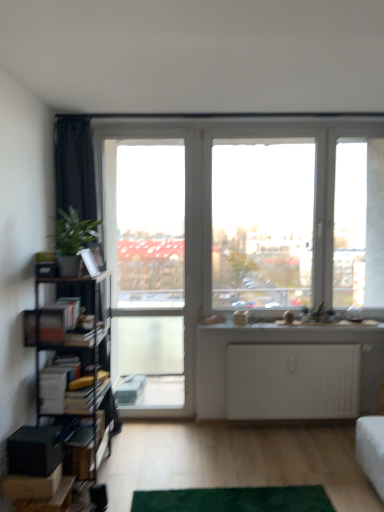
What is the approximate width of green carpet at lower center?

10.68 inches.

In order to face green carpet at lower center, should I rotate leftwards or rightwards?

Turn right by 5.164 degrees to look at green carpet at lower center.

I want to click on hardcover books at left, the second book positioned from the top, so click(x=65, y=390).

Where is `green leafy plant at left`? The height and width of the screenshot is (512, 384). green leafy plant at left is located at coordinates (74, 243).

Find the location of a particular element. The width and height of the screenshot is (384, 512). metallic black bookshelf at left is located at coordinates (90, 449).

Identify the location of hardcover books at left, the 1th book when ordered from top to bottom. The height and width of the screenshot is (512, 384). click(x=67, y=310).

You are a GUI agent. You are given a task and a screenshot of the screen. Output one action in this format:
    pyautogui.click(x=<x>, y=<y>)
    Task: Click on the green carpet at lower center
    
    Given the screenshot: What is the action you would take?
    pyautogui.click(x=234, y=499)

Is metallic black bookshelf at left in front of or behind transparent glass window at center in the image?

Visually, metallic black bookshelf at left is located in front of transparent glass window at center.

From their relative heights in the image, would you say metallic black bookshelf at left is taller or shorter than transparent glass window at center?

Clearly, metallic black bookshelf at left is shorter compared to transparent glass window at center.

Where is `shelf lying on the left of transparent glass window at center`? Image resolution: width=384 pixels, height=512 pixels. shelf lying on the left of transparent glass window at center is located at coordinates (90, 449).

In the scene shown: From a real-world perspective, is transparent glass window at center above or below metallic black bookshelf at left?

In terms of real-world spatial position, transparent glass window at center is above metallic black bookshelf at left.

How far apart are transparent glass window at center and metallic black bookshelf at left?

transparent glass window at center and metallic black bookshelf at left are 2.66 meters apart.

Between transparent glass window at center and metallic black bookshelf at left, which one has larger width?

Wider between the two is metallic black bookshelf at left.

Considering the sizes of transparent glass window at center and metallic black bookshelf at left in the image, is transparent glass window at center bigger or smaller than metallic black bookshelf at left?

In the image, transparent glass window at center appears to be smaller than metallic black bookshelf at left.

Considering the relative sizes of green carpet at lower center and transparent glass window at center in the image provided, is green carpet at lower center wider than transparent glass window at center?

Yes.

Does green carpet at lower center appear on the right side of transparent glass window at center?

Incorrect, green carpet at lower center is not on the right side of transparent glass window at center.

Looking at this image, between green carpet at lower center and transparent glass window at center, which one has smaller size?

With smaller size is green carpet at lower center.

Considering the positions of objects green carpet at lower center and transparent glass window at center in the image provided, who is behind, green carpet at lower center or transparent glass window at center?

transparent glass window at center is further from the camera.

How far apart are transparent glass window at center and clear glass screen door at center?

A distance of 1.48 meters exists between transparent glass window at center and clear glass screen door at center.

From a real-world perspective, is transparent glass window at center over clear glass screen door at center?

Yes, from a real-world perspective, transparent glass window at center is on top of clear glass screen door at center.

From the image's perspective, is transparent glass window at center positioned above or below clear glass screen door at center?

From the image's perspective, transparent glass window at center appears above clear glass screen door at center.

Is transparent glass window at center outside of clear glass screen door at center?

Yes, transparent glass window at center is outside of clear glass screen door at center.

Consider the image. Which object is more forward, green leafy plant at left or transparent glass window at center?

green leafy plant at left.

From the image's perspective, which is above, green leafy plant at left or transparent glass window at center?

transparent glass window at center appears higher in the image.

Is green leafy plant at left looking in the opposite direction of transparent glass window at center?

No, green leafy plant at left's orientation is not away from transparent glass window at center.

From the image's perspective, does clear glass screen door at center appear lower than metallic black bookshelf at left?

No, from the image's perspective, clear glass screen door at center is not below metallic black bookshelf at left.

From a real-world perspective, is clear glass screen door at center above or below metallic black bookshelf at left?

clear glass screen door at center is situated higher than metallic black bookshelf at left in the real world.

Is clear glass screen door at center behind metallic black bookshelf at left?

That is True.

From their relative heights in the image, would you say clear glass screen door at center is taller or shorter than green carpet at lower center?

Considering their sizes, clear glass screen door at center has more height than green carpet at lower center.

Between point (187, 339) and point (257, 494), which one is positioned behind?

The point (187, 339) is behind.

Is clear glass screen door at center facing towards green carpet at lower center?

No, clear glass screen door at center is not oriented towards green carpet at lower center.

Are clear glass screen door at center and green carpet at lower center far apart?

Absolutely, clear glass screen door at center is distant from green carpet at lower center.

At what (x,y) coordinates should I click in order to perform the action: click on window screen above the metallic black bookshelf at left (from the image's perspective). Please return your answer as a coordinate pair (x, y). The image size is (384, 512). Looking at the image, I should click on (262, 222).

This screenshot has height=512, width=384. In order to click on window screen lying behind the metallic black bookshelf at left in this screenshot , I will do `click(262, 222)`.

Which object lies further to the anchor point green carpet at lower center, green leafy plant at left or hardcover books at left, the second book positioned from the top?

The object further to green carpet at lower center is green leafy plant at left.

Looking at the image, which one is located further to hardcover books at left, the first book when ordered from bottom to top, transparent glass window at center or hardcover books at left, marked as the 2th book in a bottom-to-top arrangement?

transparent glass window at center lies further to hardcover books at left, the first book when ordered from bottom to top, than the other object.

When comparing their distances from green carpet at lower center, does hardcover books at left, the second book positioned from the top, or hardcover books at left, marked as the 2th book in a bottom-to-top arrangement, seem closer?

hardcover books at left, the second book positioned from the top, is positioned closer to the anchor green carpet at lower center.

When comparing their distances from hardcover books at left, the 1th book when ordered from top to bottom, does green carpet at lower center or clear glass screen door at center seem further?

Among the two, green carpet at lower center is located further to hardcover books at left, the 1th book when ordered from top to bottom.

Considering their positions, is transparent glass window at center positioned closer to hardcover books at left, marked as the 2th book in a bottom-to-top arrangement, than clear glass screen door at center?

clear glass screen door at center is closer to hardcover books at left, marked as the 2th book in a bottom-to-top arrangement.

Based on their spatial positions, is green carpet at lower center or clear glass screen door at center further from hardcover books at left, the second book positioned from the top?

clear glass screen door at center is positioned further to the anchor hardcover books at left, the second book positioned from the top.

Considering their positions, is hardcover books at left, the second book positioned from the top, positioned closer to transparent glass window at center than metallic black bookshelf at left?

metallic black bookshelf at left is closer to transparent glass window at center.

Estimate the real-world distances between objects in this image. Which object is closer to hardcover books at left, the second book positioned from the top, green leafy plant at left or clear glass screen door at center?

green leafy plant at left is closer to hardcover books at left, the second book positioned from the top.

Where is `shelf between transparent glass window at center and green carpet at lower center in the vertical direction`? The width and height of the screenshot is (384, 512). shelf between transparent glass window at center and green carpet at lower center in the vertical direction is located at coordinates (90, 449).

This screenshot has width=384, height=512. What are the coordinates of `book between hardcover books at left, marked as the 2th book in a bottom-to-top arrangement, and transparent glass window at center, in the horizontal direction` in the screenshot? It's located at (65, 390).

Identify the location of shelf between green leafy plant at left and green carpet at lower center vertically. The image size is (384, 512). (90, 449).

Locate an element on the screen. The height and width of the screenshot is (512, 384). shelf located between hardcover books at left, marked as the 2th book in a bottom-to-top arrangement, and green carpet at lower center in the left-right direction is located at coordinates (90, 449).